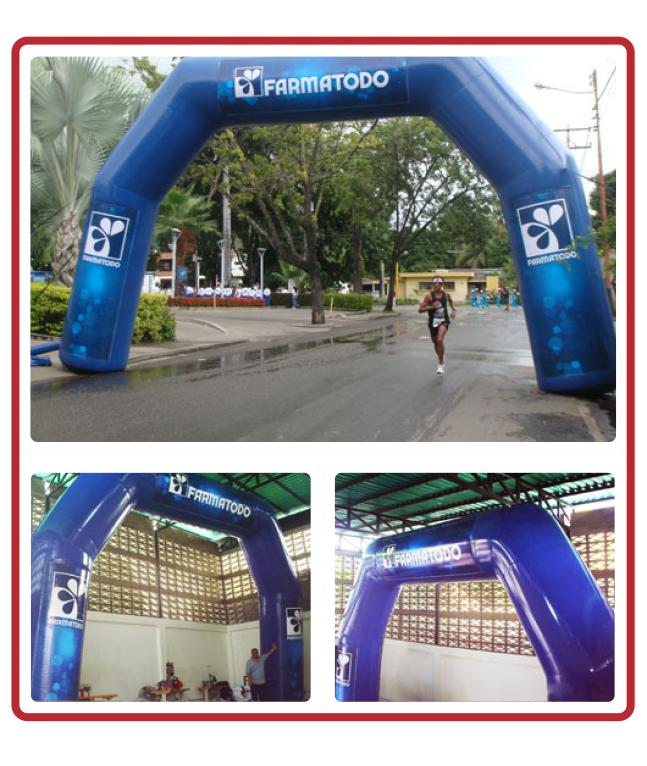
The height and width of the screenshot is (766, 647). I want to click on white wall, so click(x=496, y=679), click(x=199, y=646), click(x=248, y=637), click(x=305, y=650).